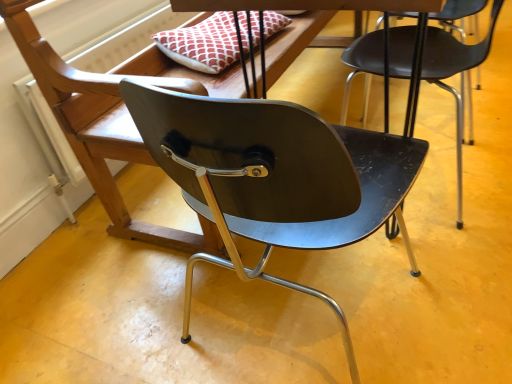
Question: In which direction should I rotate to look at matte black chair at center, which is the second chair in right-to-left order?

Choices:
 (A) left
 (B) right

Answer: (B)

Question: Which direction should I rotate to face matte black chair at center, acting as the second chair starting from the left, — up or down?

Choices:
 (A) down
 (B) up

Answer: (B)

Question: Is matte black chair at center, the 1th chair viewed from the left, at the back of matte black chair at center, which ranks as the first chair in right-to-left order?

Choices:
 (A) yes
 (B) no

Answer: (B)

Question: Is matte black chair at center, which ranks as the first chair in right-to-left order, touching matte black chair at center, which is the second chair in right-to-left order?

Choices:
 (A) yes
 (B) no

Answer: (B)

Question: Is matte black chair at center, which ranks as the first chair in right-to-left order, further to camera compared to matte black chair at center, the 1th chair viewed from the left?

Choices:
 (A) yes
 (B) no

Answer: (A)

Question: Does matte black chair at center, which ranks as the first chair in right-to-left order, have a smaller size compared to matte black chair at center, the 1th chair viewed from the left?

Choices:
 (A) no
 (B) yes

Answer: (B)

Question: Does matte black chair at center, acting as the second chair starting from the left, lie in front of matte black chair at center, which is the second chair in right-to-left order?

Choices:
 (A) no
 (B) yes

Answer: (A)

Question: Is matte black chair at center, which ranks as the first chair in right-to-left order, at the right side of matte black chair at center, the 1th chair viewed from the left?

Choices:
 (A) no
 (B) yes

Answer: (B)

Question: Is the surface of matte black chair at center, which is the second chair in right-to-left order, in direct contact with matte black chair at center, which ranks as the first chair in right-to-left order?

Choices:
 (A) yes
 (B) no

Answer: (B)

Question: From the image's perspective, would you say matte black chair at center, which is the second chair in right-to-left order, is shown under matte black chair at center, acting as the second chair starting from the left?

Choices:
 (A) yes
 (B) no

Answer: (A)

Question: Is matte black chair at center, which is the second chair in right-to-left order, thinner than matte black chair at center, which ranks as the first chair in right-to-left order?

Choices:
 (A) no
 (B) yes

Answer: (A)

Question: Is matte black chair at center, acting as the second chair starting from the left, inside matte black chair at center, which is the second chair in right-to-left order?

Choices:
 (A) yes
 (B) no

Answer: (B)

Question: Is matte black chair at center, which is the second chair in right-to-left order, shorter than matte black chair at center, acting as the second chair starting from the left?

Choices:
 (A) no
 (B) yes

Answer: (A)

Question: Does matte black chair at center, which is the second chair in right-to-left order, have a larger size compared to matte black chair at center, which ranks as the first chair in right-to-left order?

Choices:
 (A) no
 (B) yes

Answer: (B)

Question: In terms of size, does matte black chair at center, which is the second chair in right-to-left order, appear bigger or smaller than matte black chair at center, which ranks as the first chair in right-to-left order?

Choices:
 (A) small
 (B) big

Answer: (B)